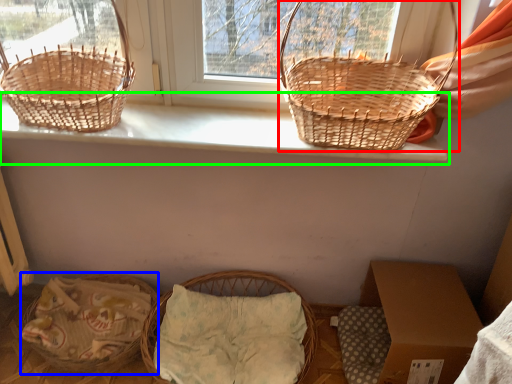
Question: Which object is positioned farthest from picnic basket (highlighted by a red box)? Select from basket (highlighted by a blue box) and window sill (highlighted by a green box).

Choices:
 (A) basket
 (B) window sill

Answer: (A)